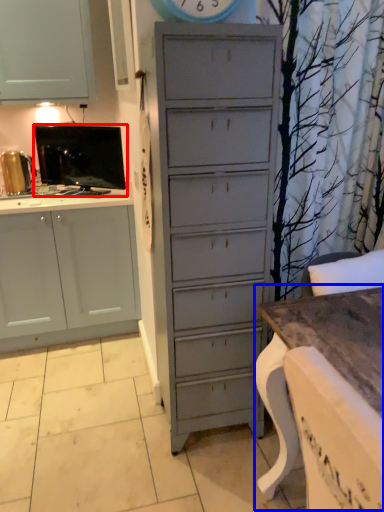
Question: Among these objects, which one is farthest to the camera, appliance (highlighted by a red box) or table (highlighted by a blue box)?

Choices:
 (A) appliance
 (B) table

Answer: (A)